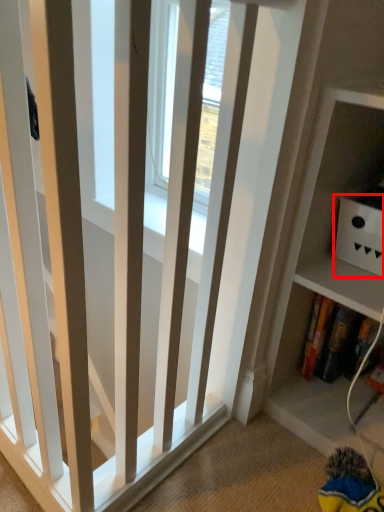
Question: From the image's perspective, where is cabinet (annotated by the red box) located in relation to book in the image?

Choices:
 (A) above
 (B) below

Answer: (A)